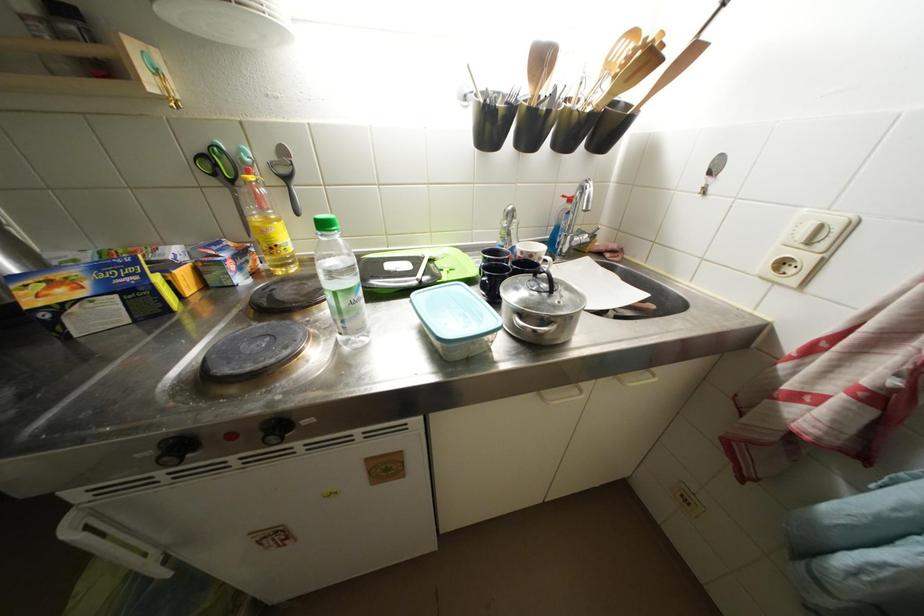
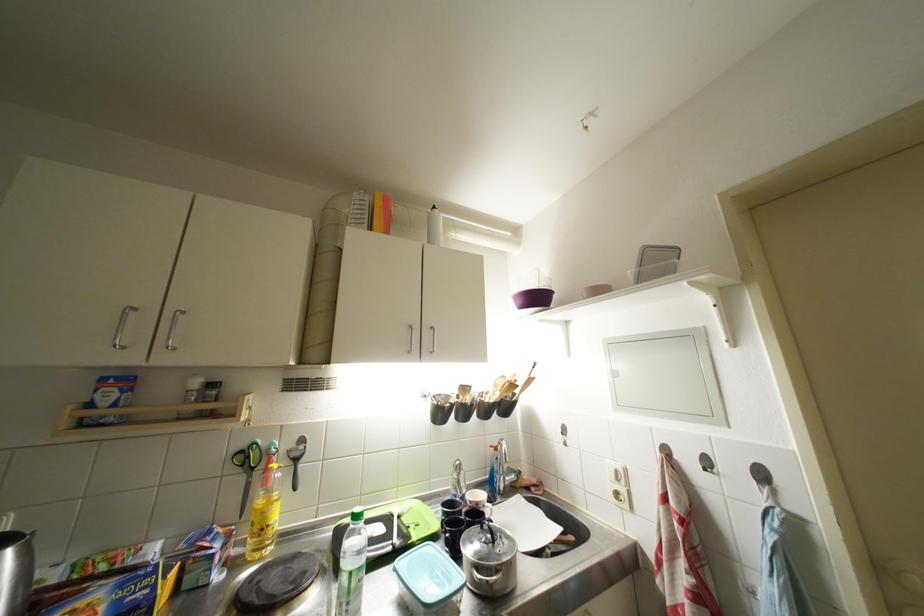
Locate, in the second image, the point that corresponds to point (349, 309) in the first image.

(359, 589)